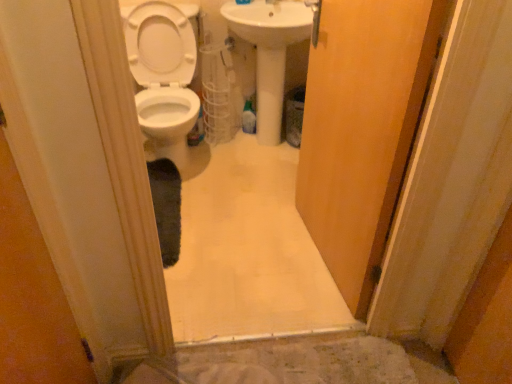
What do you see at coordinates (163, 74) in the screenshot? This screenshot has width=512, height=384. I see `white glossy toilet at left` at bounding box center [163, 74].

The width and height of the screenshot is (512, 384). What do you see at coordinates (269, 53) in the screenshot?
I see `white glossy sink at center` at bounding box center [269, 53].

Locate an element on the screen. The height and width of the screenshot is (384, 512). white glossy toilet at left is located at coordinates (163, 74).

Considering the sizes of objects white glossy toilet at left and white glossy sink at center in the image provided, who is thinner, white glossy toilet at left or white glossy sink at center?

Thinner between the two is white glossy sink at center.

The image size is (512, 384). What are the coordinates of `sink above the white glossy toilet at left (from a real-world perspective)` in the screenshot? It's located at (269, 53).

Is white glossy toilet at left positioned with its back to white glossy sink at center?

No, white glossy toilet at left's orientation is not away from white glossy sink at center.

From the image's perspective, is wooden door at center located beneath white glossy toilet at left?

Indeed, from the image's perspective, wooden door at center is shown beneath white glossy toilet at left.

Locate an element on the screen. toilet on the left of the wooden door at center is located at coordinates (163, 74).

Is wooden door at center oriented away from white glossy toilet at left?

No, wooden door at center is not facing the opposite direction of white glossy toilet at left.

How distant is wooden door at center from white glossy toilet at left?

wooden door at center is 36.04 inches away from white glossy toilet at left.

Who is more distant, white glossy sink at center or white glossy toilet at left?

Positioned behind is white glossy sink at center.

How far apart are white glossy sink at center and white glossy toilet at left?

white glossy sink at center and white glossy toilet at left are 47.45 centimeters apart.

From the image's perspective, which one is positioned lower, white glossy sink at center or white glossy toilet at left?

white glossy toilet at left is shown below in the image.

Is white glossy sink at center shorter than white glossy toilet at left?

No, white glossy sink at center is not shorter than white glossy toilet at left.

Where is `door lying in front of the white glossy sink at center`? The width and height of the screenshot is (512, 384). door lying in front of the white glossy sink at center is located at coordinates (362, 129).

Is wooden door at center located outside white glossy sink at center?

wooden door at center is positioned outside white glossy sink at center.

Which object is positioned more to the left, wooden door at center or white glossy sink at center?

Positioned to the left is white glossy sink at center.

From a real-world perspective, is wooden door at center positioned above or below white glossy sink at center?

From a real-world perspective, wooden door at center is physically above white glossy sink at center.

Looking at this image, which is closer, (x=281, y=37) or (x=384, y=74)?

Point (x=384, y=74)

Would you say white glossy sink at center contains wooden door at center?

No, wooden door at center is not inside white glossy sink at center.

Considering the sizes of objects white glossy sink at center and wooden door at center in the image provided, who is smaller, white glossy sink at center or wooden door at center?

wooden door at center.

Is white glossy sink at center positioned in front of wooden door at center?

No, it is not.

Between white glossy toilet at left and wooden door at center, which one is positioned in front?

wooden door at center.

From a real-world perspective, is white glossy toilet at left physically above wooden door at center?

No, from a real-world perspective, white glossy toilet at left is not above wooden door at center.

Locate an element on the screen. The height and width of the screenshot is (384, 512). toilet located behind the wooden door at center is located at coordinates (163, 74).

Which is correct: white glossy toilet at left is inside wooden door at center, or outside of it?

white glossy toilet at left lies outside wooden door at center.

Find the location of a particular element. This screenshot has height=384, width=512. sink above the white glossy toilet at left (from a real-world perspective) is located at coordinates (269, 53).

Where is `door that appears below the white glossy toilet at left (from the image's perspective)`? The image size is (512, 384). door that appears below the white glossy toilet at left (from the image's perspective) is located at coordinates (362, 129).

Based on their spatial positions, is white glossy sink at center or wooden door at center further from white glossy toilet at left?

wooden door at center is further to white glossy toilet at left.

Based on the photo, considering their positions, is wooden door at center positioned closer to white glossy toilet at left than white glossy sink at center?

white glossy sink at center is closer to white glossy toilet at left.

Estimate the real-world distances between objects in this image. Which object is further from white glossy sink at center, white glossy toilet at left or wooden door at center?

wooden door at center.

Considering their positions, is white glossy toilet at left positioned closer to wooden door at center than white glossy sink at center?

Based on the image, white glossy sink at center appears to be nearer to wooden door at center.

Based on their spatial positions, is white glossy sink at center or white glossy toilet at left further from wooden door at center?

white glossy toilet at left.

From the image, which object appears to be nearer to white glossy sink at center, wooden door at center or white glossy toilet at left?

The object closer to white glossy sink at center is white glossy toilet at left.

Find the location of `toilet between wooden door at center and white glossy sink at center in the front-back direction`. toilet between wooden door at center and white glossy sink at center in the front-back direction is located at coordinates (163, 74).